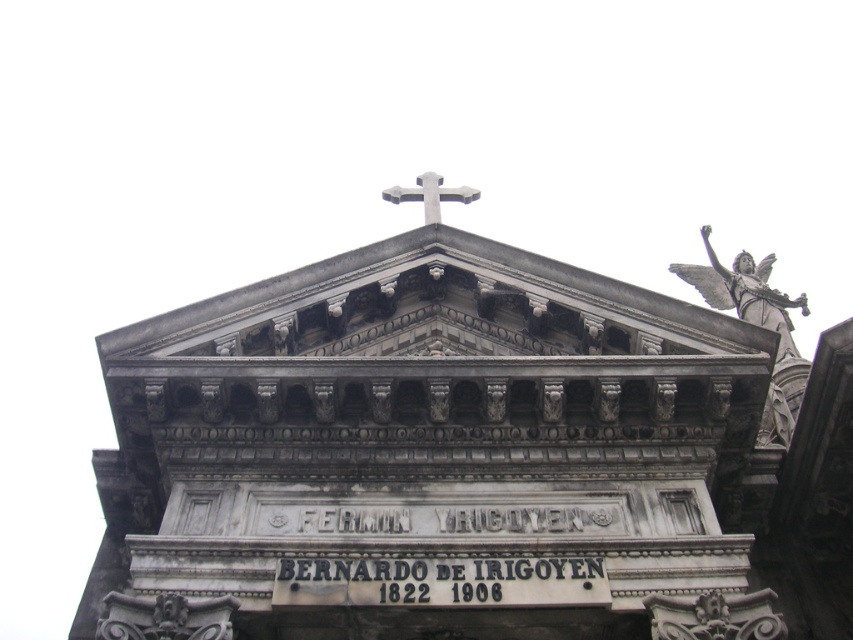
Looking at this image, is gray stone church at center below metallic cross at center?

Yes, gray stone church at center is below metallic cross at center.

Measure the distance between gray stone church at center and camera.

gray stone church at center is 119.49 feet away from camera.

Find the location of a particular element. gray stone church at center is located at coordinates (473, 458).